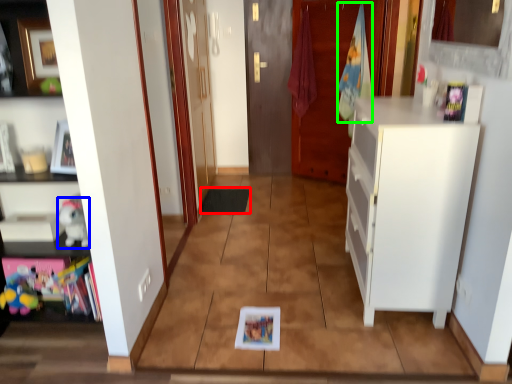
Question: Considering the real-world distances, which object is closest to mat (highlighted by a red box)? toy (highlighted by a blue box) or laundry (highlighted by a green box).

Choices:
 (A) toy
 (B) laundry

Answer: (B)